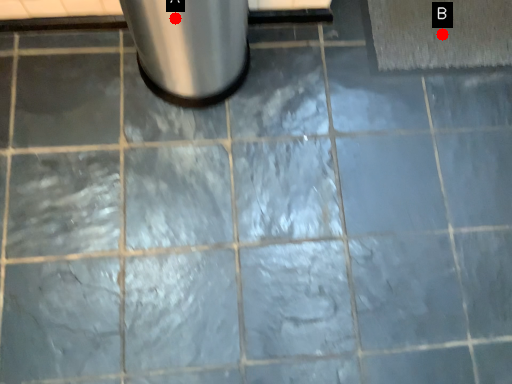
Question: Two points are circled on the image, labeled by A and B beside each circle. Among these points, which one is nearest to the camera?

Choices:
 (A) A is closer
 (B) B is closer

Answer: (A)